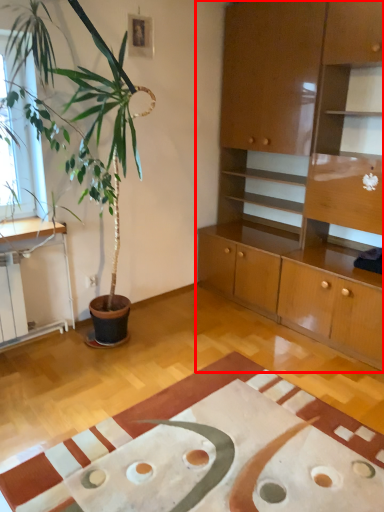
Question: From the image's perspective, where is cabinetry (annotated by the red box) located relative to plain?

Choices:
 (A) above
 (B) below

Answer: (A)